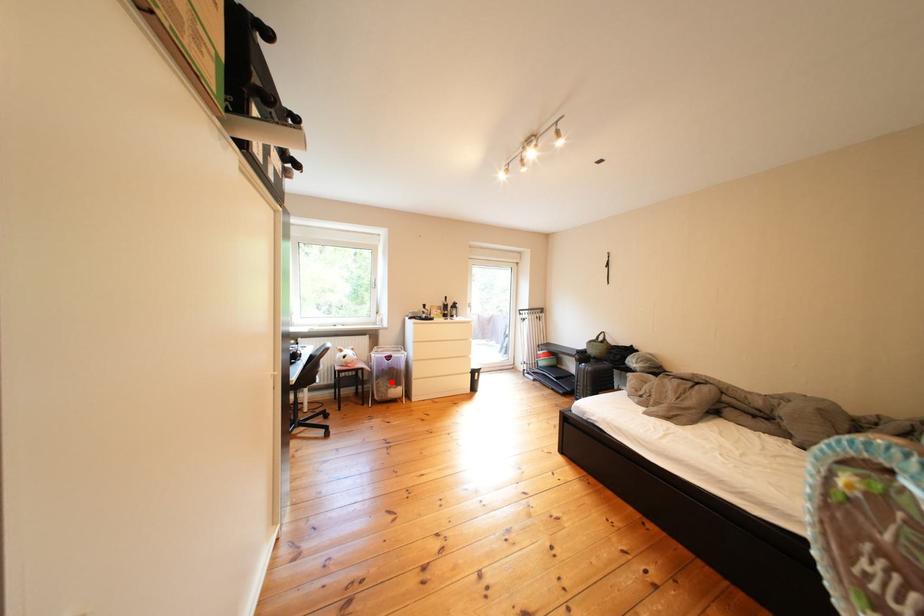
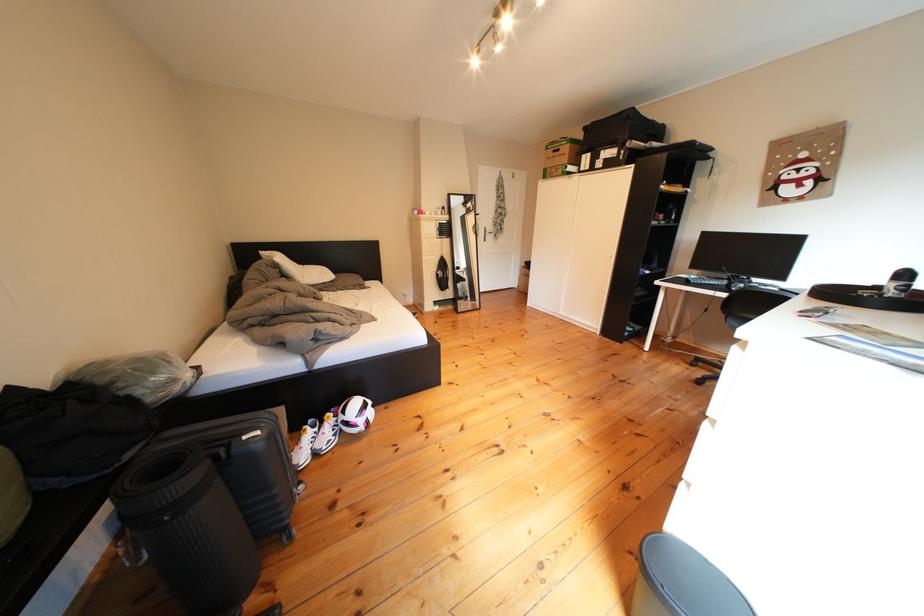
Question: I am providing you with two images of the same scene from different viewpoints. A red point is marked on the first image. Can you still see the location of the red point in image 2?

Choices:
 (A) Yes
 (B) No

Answer: (B)